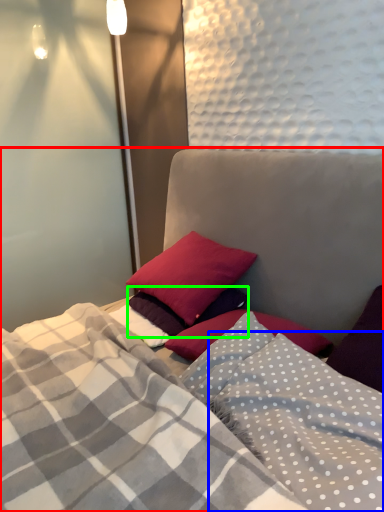
Question: Based on their relative distances, which object is nearer to bed (highlighted by a red box)? Choose from blanket (highlighted by a blue box) and pillow (highlighted by a green box).

Choices:
 (A) blanket
 (B) pillow

Answer: (A)